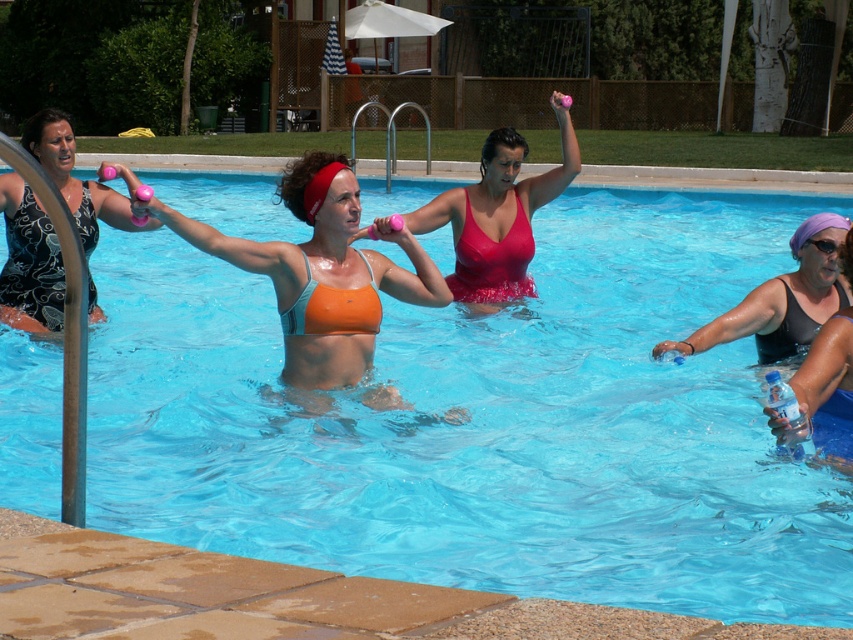
Which is more to the right, purple fabric swim cap at right or orange bikini at upper center?

Positioned to the right is purple fabric swim cap at right.

Is point (813, 344) farther from camera compared to point (22, 220)?

No, it is not.

Identify the location of purple fabric swim cap at right. (824, 394).

Which is above, blue glossy water at center or orange fabric bikini at center?

blue glossy water at center

Does blue glossy water at center lie in front of orange fabric bikini at center?

Yes, blue glossy water at center is closer to the viewer.

Is point (233, 410) behind point (303, 310)?

That is True.

Find the location of a particular element. blue glossy water at center is located at coordinates (485, 422).

Is point (387, 225) less distant than point (807, 241)?

Yes, point (387, 225) is closer to viewer.

Is orange fabric bikini top at center shorter than purple rubber goggles at upper right?

In fact, orange fabric bikini top at center may be taller than purple rubber goggles at upper right.

Is point (323, 212) farther from camera compared to point (815, 246)?

No, (323, 212) is closer to viewer.

What are the coordinates of `orange fabric bikini top at center` in the screenshot? It's located at (321, 273).